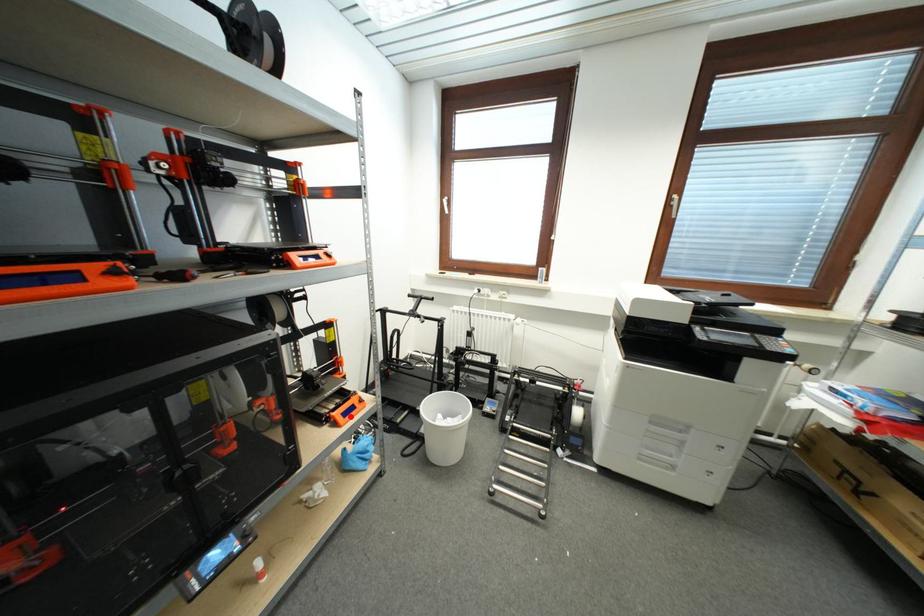
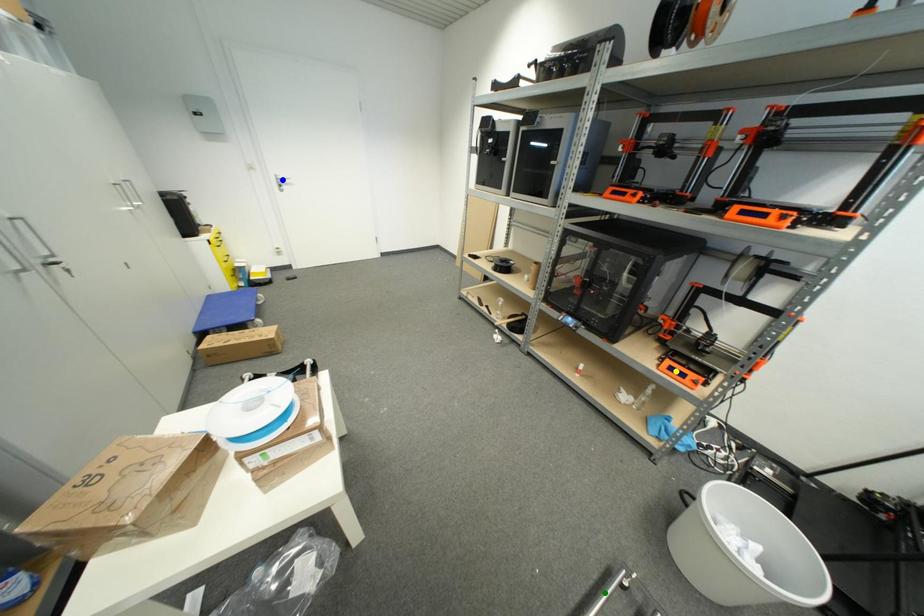
Question: I am providing you with two images of the same scene from different viewpoints. A red point is marked on the first image. You are given multiple points on the second image. Which mark in image 2 goes with the point in image 1?

Choices:
 (A) blue point
 (B) green point
 (C) yellow point

Answer: (C)